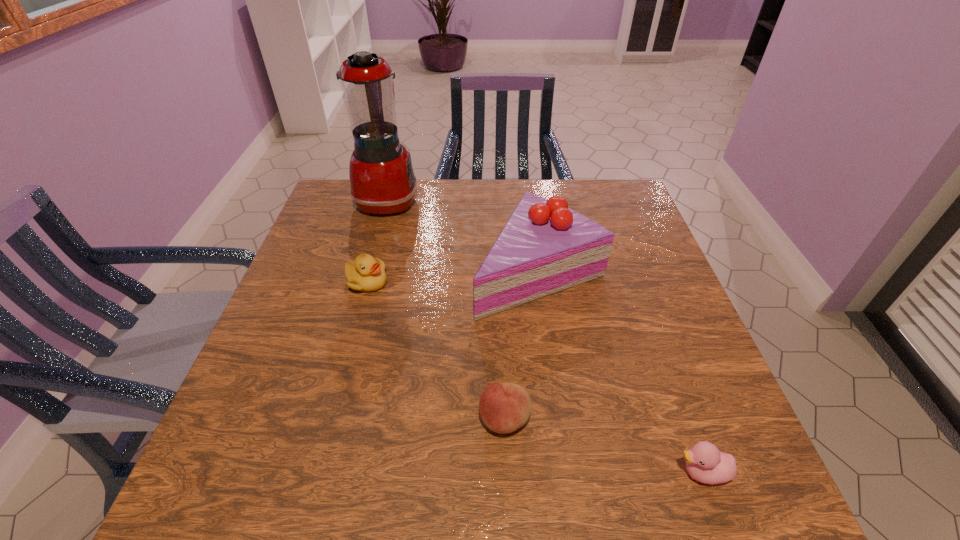
Where is `free space located on the back of the fourth farthest object`? The width and height of the screenshot is (960, 540). free space located on the back of the fourth farthest object is located at coordinates (498, 287).

Locate an element on the screen. This screenshot has width=960, height=540. blank area located on the front-facing side of the nearer duckling is located at coordinates (599, 473).

Identify the location of vacant region located on the front-facing side of the nearer duckling. This screenshot has width=960, height=540. (558, 473).

I want to click on vacant region located on the front-facing side of the nearer duckling, so click(x=552, y=473).

Identify the location of object that is at the far edge. (382, 179).

Locate an element on the screen. The height and width of the screenshot is (540, 960). object that is at the near edge is located at coordinates (705, 463).

In order to click on food processor present at the left edge in this screenshot , I will do `click(382, 179)`.

Where is `duckling that is at the left edge`? This screenshot has width=960, height=540. duckling that is at the left edge is located at coordinates (366, 274).

Locate an element on the screen. Image resolution: width=960 pixels, height=540 pixels. cake that is at the right edge is located at coordinates (545, 247).

Where is `duckling located in the right edge section of the desktop`? The width and height of the screenshot is (960, 540). duckling located in the right edge section of the desktop is located at coordinates (705, 463).